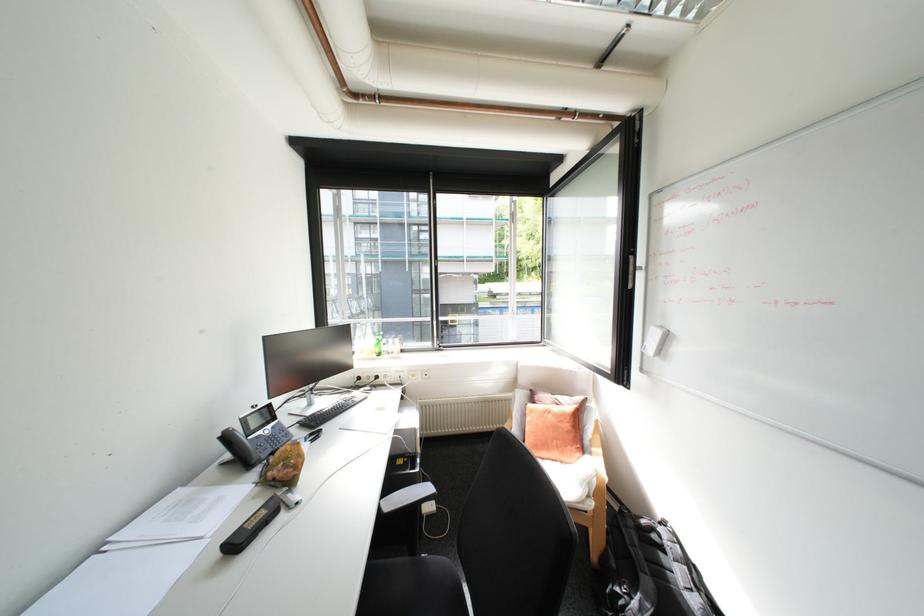
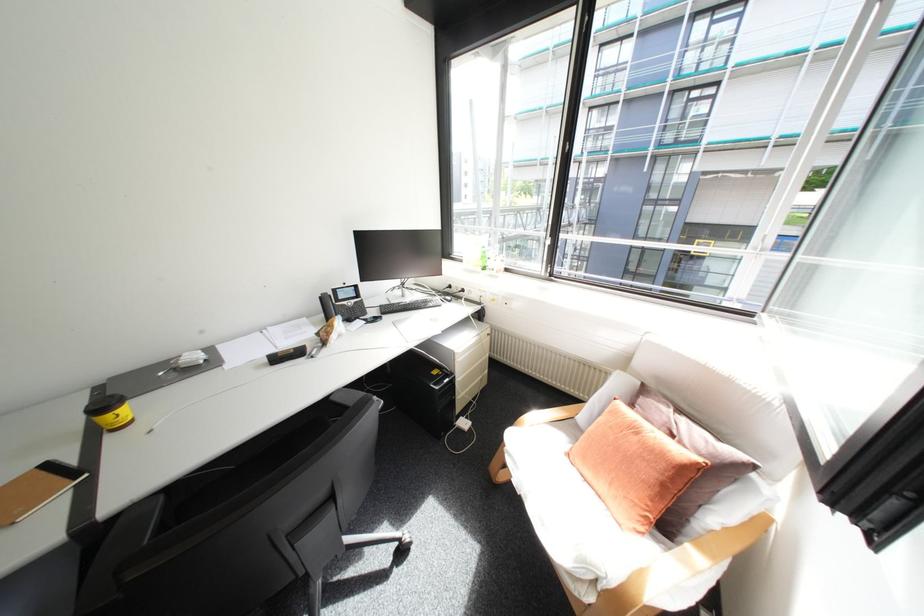
How did the camera likely rotate?

The camera rotated toward left-down.